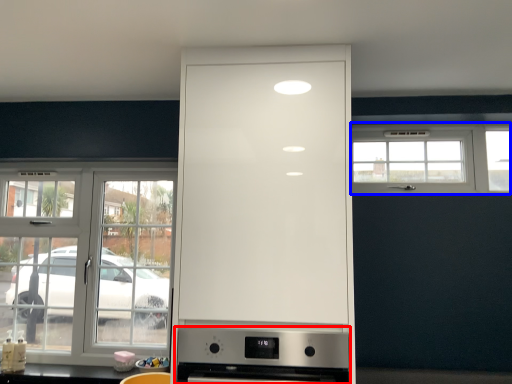
Question: Which object appears closest to the camera in this image, home appliance (highlighted by a red box) or window (highlighted by a blue box)?

Choices:
 (A) home appliance
 (B) window

Answer: (A)